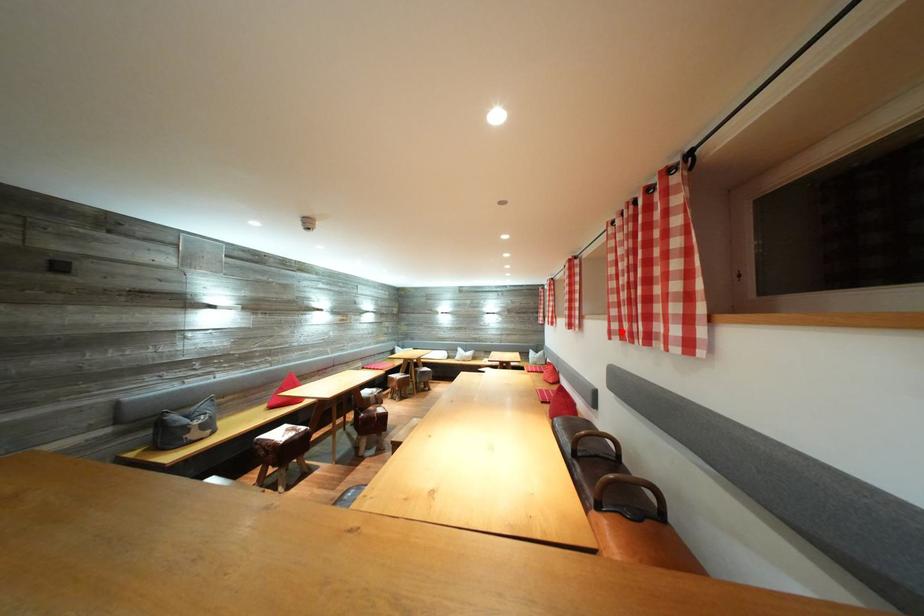
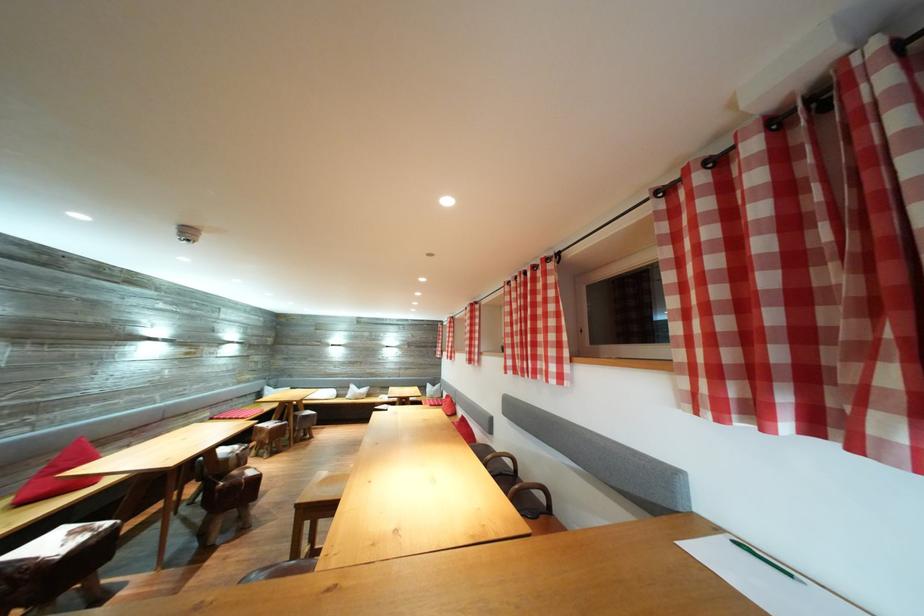
Question: I am providing you with two images of the same scene from different viewpoints. A red point is marked on the first image. Can you still see the location of the red point in image 2?

Choices:
 (A) Yes
 (B) No

Answer: (A)